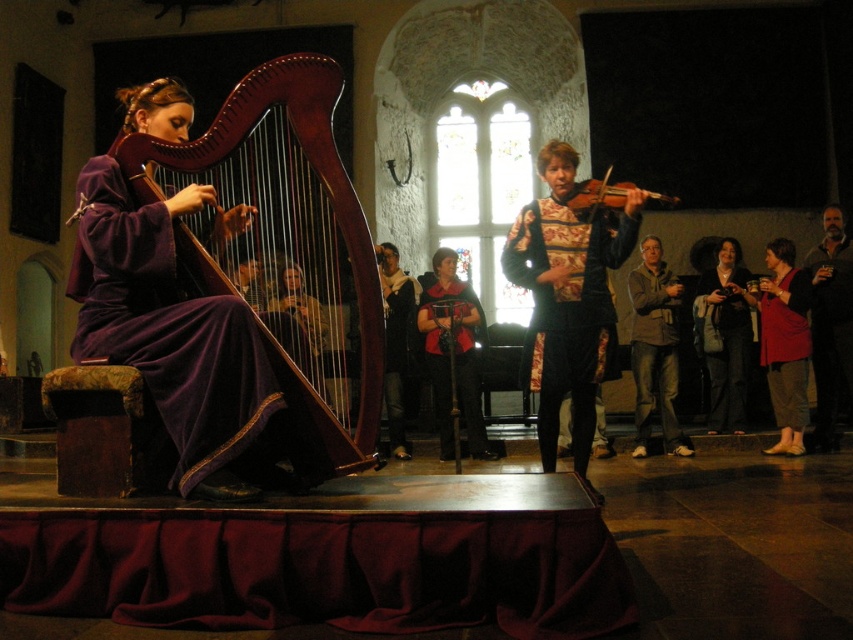
Is velvet red cape at center to the left of dark brown leather jacket at center from the viewer's perspective?

In fact, velvet red cape at center is to the right of dark brown leather jacket at center.

Is velvet red cape at center smaller than dark brown leather jacket at center?

Correct, velvet red cape at center occupies less space than dark brown leather jacket at center.

Image resolution: width=853 pixels, height=640 pixels. Describe the element at coordinates (440, 388) in the screenshot. I see `velvet red cape at center` at that location.

At what (x,y) coordinates should I click in order to perform the action: click on velvet red cape at center. Please return your answer as a coordinate pair (x, y). The height and width of the screenshot is (640, 853). Looking at the image, I should click on (440, 388).

Does matte red robe at lower right have a greater width compared to velvet red cape at center?

Yes, matte red robe at lower right is wider than velvet red cape at center.

Does point (802, 291) lie behind point (460, 410)?

That is False.

Is point (799, 344) less distant than point (445, 387)?

Yes, point (799, 344) is closer to viewer.

Locate an element on the screen. matte red robe at lower right is located at coordinates (784, 360).

Locate an element on the screen. dark brown leather jacket at lower right is located at coordinates coord(726,337).